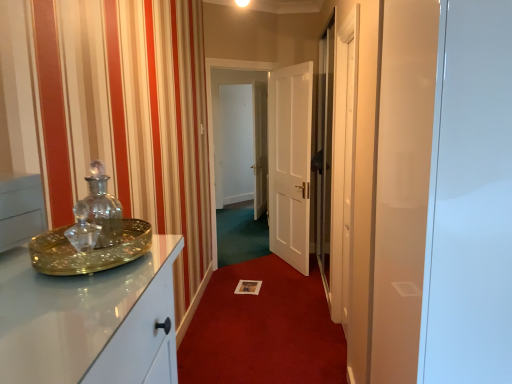
I want to click on transparent glass door at center, which appears as the first glass door when viewed from the left, so click(x=290, y=162).

Find the location of a particular element. This screenshot has width=512, height=384. white paper at center is located at coordinates (263, 329).

Considering the positions of points (294, 121) and (301, 70), is point (294, 121) closer to camera compared to point (301, 70)?

No.

From a real-world perspective, relative to transparent glass door at center, the second glass door viewed from the front, is white wooden door at center vertically above or below?

From a real-world perspective, white wooden door at center is physically below transparent glass door at center, the second glass door viewed from the front.

Which of these two, white wooden door at center or transparent glass door at center, the second glass door in the right-to-left sequence, stands shorter?

With less height is white wooden door at center.

Could you tell me if white wooden door at center is turned towards transparent glass door at center, the second glass door in the right-to-left sequence?

Yes, white wooden door at center is aimed at transparent glass door at center, the second glass door in the right-to-left sequence.

From the image's perspective, which is below, white wooden door at center or white paper at center?

white paper at center.

Is white wooden door at center oriented away from white paper at center?

That's not correct — white wooden door at center is not looking away from white paper at center.

Can you confirm if white wooden door at center is shorter than white paper at center?

In fact, white wooden door at center may be taller than white paper at center.

Find the location of a particular element. This screenshot has height=384, width=512. plain lying below the white wooden door at center (from the image's perspective) is located at coordinates (263, 329).

Is white wooden door at center facing away from matte glass tray at left?

No, white wooden door at center is not facing the opposite direction of matte glass tray at left.

Is white wooden door at center next to matte glass tray at left?

white wooden door at center and matte glass tray at left are clearly separated.

From a real-world perspective, does white wooden door at center sit lower than matte glass tray at left?

Indeed, from a real-world perspective, white wooden door at center is positioned beneath matte glass tray at left.

I want to click on glass door located in front of the white wooden door at center, so click(470, 200).

Which is more distant, (x=286, y=93) or (x=500, y=210)?

The point (x=286, y=93) is more distant.

Considering the positions of objects white wooden door at center and transparent glass door at right, marked as the 2th glass door in a back-to-front arrangement, in the image provided, who is in front, white wooden door at center or transparent glass door at right, marked as the 2th glass door in a back-to-front arrangement,?

transparent glass door at right, marked as the 2th glass door in a back-to-front arrangement, is in front.

Considering the positions of objects white wooden door at center and transparent glass door at right, marked as the 2th glass door in a back-to-front arrangement, in the image provided, who is more to the left, white wooden door at center or transparent glass door at right, marked as the 2th glass door in a back-to-front arrangement,?

white wooden door at center.

Identify the location of glass door behind the white wooden door at center. (290, 162).

Can you confirm if transparent glass door at center, the second glass door viewed from the front, is positioned to the right of white wooden door at center?

In fact, transparent glass door at center, the second glass door viewed from the front, is to the left of white wooden door at center.

Between transparent glass door at center, the second glass door in the right-to-left sequence, and white wooden door at center, which one has smaller size?

white wooden door at center.

Can you tell me how much transparent glass door at center, the second glass door in the right-to-left sequence, and white wooden door at center differ in facing direction?

The angular difference between transparent glass door at center, the second glass door in the right-to-left sequence, and white wooden door at center is 94.5 degrees.

From the image's perspective, does matte glass tray at left appear higher than white wooden door at center?

Actually, matte glass tray at left appears below white wooden door at center in the image.

From a real-world perspective, is matte glass tray at left physically below white wooden door at center?

No, from a real-world perspective, matte glass tray at left is not below white wooden door at center.

Is matte glass tray at left bigger or smaller than white wooden door at center?

In the image, matte glass tray at left appears to be smaller than white wooden door at center.

Is white paper at center not close to transparent glass door at right, which appears as the first glass door when viewed from the right?

Yes, white paper at center is far from transparent glass door at right, which appears as the first glass door when viewed from the right.

Which is closer to the camera, [324,343] or [510,367]?

Point [324,343] is positioned farther from the camera compared to point [510,367].

Considering the sizes of objects white paper at center and transparent glass door at right, acting as the second glass door starting from the left, in the image provided, who is bigger, white paper at center or transparent glass door at right, acting as the second glass door starting from the left,?

transparent glass door at right, acting as the second glass door starting from the left, is bigger.

Identify the location of glass door above the white wooden door at center (from the image's perspective). (290, 162).

I want to click on plain below the white wooden door at center (from the image's perspective), so click(263, 329).

When comparing their distances from white wooden door at center, does transparent glass door at right, acting as the second glass door starting from the left, or transparent glass door at center, the second glass door viewed from the front, seem further?

transparent glass door at right, acting as the second glass door starting from the left.

Looking at this image, based on their spatial positions, is white wooden door at center or transparent glass door at center, the second glass door in the right-to-left sequence, closer to matte glass tray at left?

transparent glass door at center, the second glass door in the right-to-left sequence.

Which object lies further to the anchor point matte glass tray at left, white paper at center or transparent glass door at center, which appears as the first glass door when viewed from the left?

transparent glass door at center, which appears as the first glass door when viewed from the left.

Considering their positions, is white paper at center positioned closer to transparent glass door at right, the first glass door positioned from the front, than matte glass tray at left?

Based on the image, matte glass tray at left appears to be nearer to transparent glass door at right, the first glass door positioned from the front.

Looking at the image, which one is located further to matte glass tray at left, white paper at center or white wooden door at center?

Among the two, white wooden door at center is located further to matte glass tray at left.

Based on their spatial positions, is transparent glass door at center, the second glass door viewed from the front, or white wooden door at center closer to transparent glass door at right, marked as the 2th glass door in a back-to-front arrangement?

The object closer to transparent glass door at right, marked as the 2th glass door in a back-to-front arrangement, is transparent glass door at center, the second glass door viewed from the front.

Based on their spatial positions, is matte glass tray at left or white wooden door at center further from transparent glass door at right, the first glass door positioned from the front?

white wooden door at center.

Which object lies further to the anchor point white wooden door at center, matte glass tray at left or transparent glass door at center, the second glass door in the right-to-left sequence?

matte glass tray at left lies further to white wooden door at center than the other object.

Where is `glass door between matte glass tray at left and transparent glass door at center, positioned as the first glass door in back-to-front order, from front to back`? glass door between matte glass tray at left and transparent glass door at center, positioned as the first glass door in back-to-front order, from front to back is located at coordinates (470, 200).

Locate an element on the screen. The image size is (512, 384). door between white paper at center and transparent glass door at center, the second glass door in the right-to-left sequence, in the front-back direction is located at coordinates (290, 163).

At what (x,y) coordinates should I click in order to perform the action: click on plain located between transparent glass door at right, acting as the second glass door starting from the left, and transparent glass door at center, which appears as the first glass door when viewed from the left, in the depth direction. Please return your answer as a coordinate pair (x, y). Looking at the image, I should click on (263, 329).

Find the location of `plain between matte glass tray at left and white wooden door at center along the z-axis`. plain between matte glass tray at left and white wooden door at center along the z-axis is located at coordinates (263, 329).